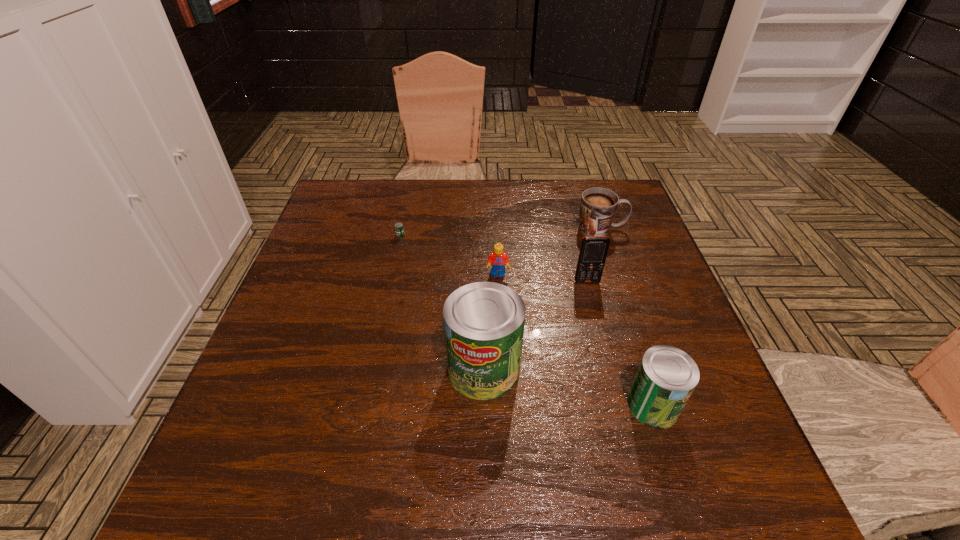
You are a GUI agent. You are given a task and a screenshot of the screen. Output one action in this format:
    pyautogui.click(x=<x>, y=<y>)
    Task: Click on the free space located on the back of the beer can
    
    Given the screenshot: What is the action you would take?
    pyautogui.click(x=412, y=183)

This screenshot has width=960, height=540. Identify the location of vacant space situated on the side of the mug with the handle. (644, 229).

You are a GUI agent. You are given a task and a screenshot of the screen. Output one action in this format:
    pyautogui.click(x=<x>, y=<y>)
    Task: Click on the vacant space located on the face of the Lego
    The image size is (960, 540).
    Given the screenshot: What is the action you would take?
    pyautogui.click(x=499, y=302)

In order to click on free space located 0.350m on the screen of the cellular telephone in this screenshot , I will do `click(621, 416)`.

The image size is (960, 540). In order to click on object that is at the far edge in this screenshot , I will do `click(598, 206)`.

The width and height of the screenshot is (960, 540). I want to click on object located in the near edge section of the desktop, so click(667, 376).

Where is `can located at the right edge`? can located at the right edge is located at coordinates [667, 376].

Identify the location of mug present at the right edge. (598, 206).

The width and height of the screenshot is (960, 540). Identify the location of object that is at the far right corner. (598, 206).

Where is `object that is positioned at the near right corner`? The height and width of the screenshot is (540, 960). object that is positioned at the near right corner is located at coordinates [667, 376].